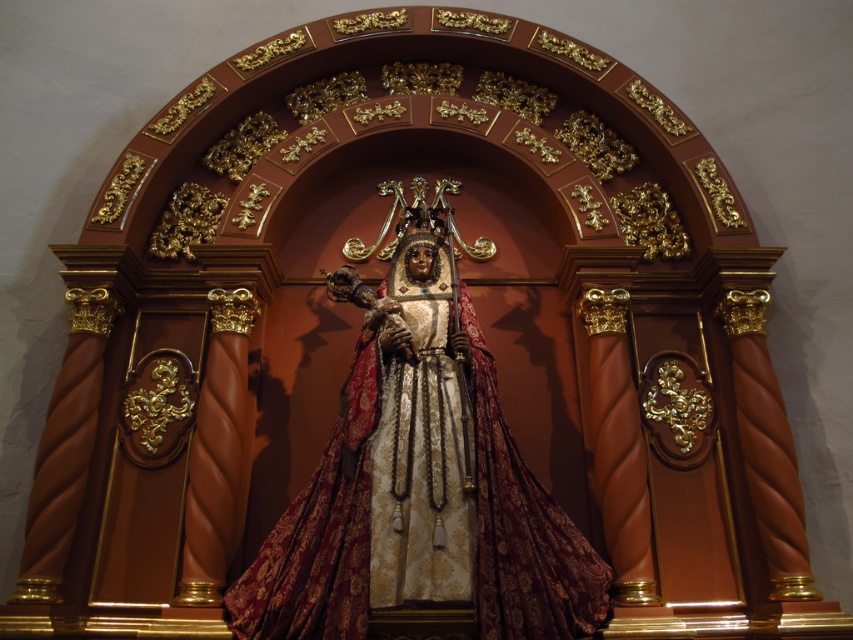
Is gold plated statue at center thinner than gold textured statue at center?

In fact, gold plated statue at center might be wider than gold textured statue at center.

Is gold plated statue at center wider than gold textured statue at center?

Indeed, gold plated statue at center has a greater width compared to gold textured statue at center.

Does point (451, 488) come farther from viewer compared to point (422, 266)?

No, it is not.

Locate an element on the screen. The width and height of the screenshot is (853, 640). gold plated statue at center is located at coordinates (419, 472).